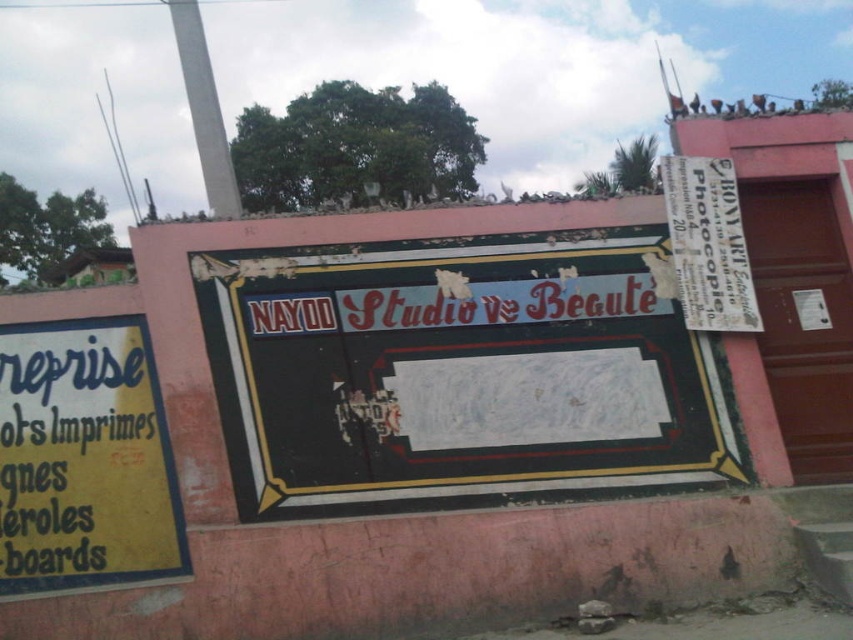
In the scene shown: Is rusty metal signboard at center to the left of white paper at upper right from the viewer's perspective?

Yes, rusty metal signboard at center is to the left of white paper at upper right.

Is rusty metal signboard at center above white paper at upper right?

No, rusty metal signboard at center is not above white paper at upper right.

Between point (351, 289) and point (717, 304), which one is positioned behind?

The point (351, 289) is behind.

The width and height of the screenshot is (853, 640). In order to click on rusty metal signboard at center in this screenshot , I will do [x=457, y=371].

How distant is rusty metal signboard at center from yellow paper at left?

The distance of rusty metal signboard at center from yellow paper at left is 1.10 meters.

What do you see at coordinates (457, 371) in the screenshot?
I see `rusty metal signboard at center` at bounding box center [457, 371].

The image size is (853, 640). Describe the element at coordinates (457, 371) in the screenshot. I see `rusty metal signboard at center` at that location.

Find the location of a particular element. rusty metal signboard at center is located at coordinates (457, 371).

Does point (51, 550) lie in front of point (682, 250)?

Yes, point (51, 550) is in front of point (682, 250).

Consider the image. Does yellow paper at left have a greater height compared to white paper at upper right?

Yes.

Is point (106, 385) positioned after point (682, 205)?

No, it is in front of (682, 205).

I want to click on yellow paper at left, so click(x=84, y=460).